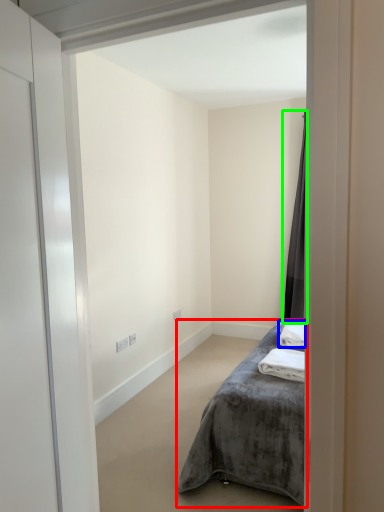
Question: Estimate the real-world distances between objects in this image. Which object is closer to bed (highlighted by a red box), bath towel (highlighted by a blue box) or curtain (highlighted by a green box)?

Choices:
 (A) bath towel
 (B) curtain

Answer: (A)